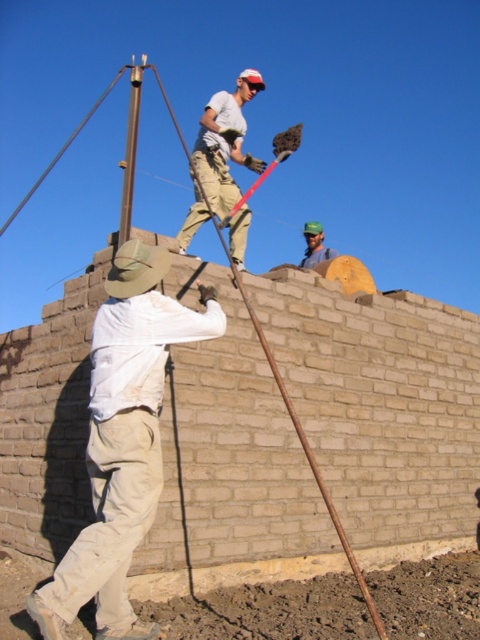
Question: Does matte khaki pants at upper center have a larger size compared to green fabric cap at upper center?

Choices:
 (A) yes
 (B) no

Answer: (A)

Question: Does white cotton shirt at center have a greater width compared to matte khaki pants at upper center?

Choices:
 (A) no
 (B) yes

Answer: (A)

Question: Which object is the farthest from the white cotton shirt at center?

Choices:
 (A) matte khaki pants at upper center
 (B) green fabric cap at upper center

Answer: (B)

Question: Which of these objects is positioned farthest from the green fabric cap at upper center?

Choices:
 (A) white cotton shirt at center
 (B) matte khaki pants at upper center

Answer: (B)

Question: Can you confirm if white cotton shirt at center is positioned to the right of green fabric cap at upper center?

Choices:
 (A) no
 (B) yes

Answer: (A)

Question: Which point is closer to the camera?

Choices:
 (A) matte khaki pants at upper center
 (B) white cotton shirt at center

Answer: (B)